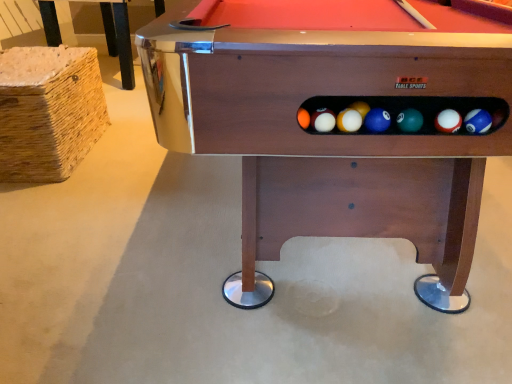
From the picture: What is the approximate width of wooden billiard table at center?

wooden billiard table at center is 3.46 feet wide.

Describe the element at coordinates (339, 132) in the screenshot. I see `wooden billiard table at center` at that location.

Identify the location of wooden billiard table at center. (339, 132).

You are a GUI agent. You are given a task and a screenshot of the screen. Output one action in this format:
    pyautogui.click(x=<x>, y=<y>)
    Task: Click on the shiny metallic pool table at upper left
    This screenshot has height=384, width=512.
    Given the screenshot: What is the action you would take?
    pyautogui.click(x=119, y=38)

The image size is (512, 384). What do you see at coordinates (119, 38) in the screenshot?
I see `shiny metallic pool table at upper left` at bounding box center [119, 38].

Identify the location of wooden billiard table at center. The image size is (512, 384). (339, 132).

Would you say wooden billiard table at center is to the left or to the right of shiny metallic pool table at upper left in the picture?

Based on their positions, wooden billiard table at center is located to the right of shiny metallic pool table at upper left.

Is the depth of wooden billiard table at center less than that of shiny metallic pool table at upper left?

Yes, wooden billiard table at center is closer to the viewer.

Which point is more distant from viewer, (505, 155) or (127, 19)?

The point (127, 19) is behind.

From the image's perspective, which one is positioned lower, wooden billiard table at center or shiny metallic pool table at upper left?

wooden billiard table at center, from the image's perspective.

From a real-world perspective, is wooden billiard table at center on top of shiny metallic pool table at upper left?

Yes, from a real-world perspective, wooden billiard table at center is on top of shiny metallic pool table at upper left.

Considering the sizes of objects wooden billiard table at center and shiny metallic pool table at upper left in the image provided, who is thinner, wooden billiard table at center or shiny metallic pool table at upper left?

wooden billiard table at center is thinner.

Considering the relative sizes of wooden billiard table at center and shiny metallic pool table at upper left in the image provided, is wooden billiard table at center taller than shiny metallic pool table at upper left?

Indeed, wooden billiard table at center has a greater height compared to shiny metallic pool table at upper left.

Which of these two, wooden billiard table at center or shiny metallic pool table at upper left, is smaller?

Smaller between the two is shiny metallic pool table at upper left.

Choose the correct answer: Is wooden billiard table at center inside shiny metallic pool table at upper left or outside it?

wooden billiard table at center lies outside shiny metallic pool table at upper left.

Is wooden billiard table at center not near shiny metallic pool table at upper left?

Indeed, wooden billiard table at center is not near shiny metallic pool table at upper left.

Could you tell me if wooden billiard table at center is facing shiny metallic pool table at upper left?

No, wooden billiard table at center is not turned towards shiny metallic pool table at upper left.

How different are the orientations of wooden billiard table at center and shiny metallic pool table at upper left in degrees?

2.32 degrees separate the facing orientations of wooden billiard table at center and shiny metallic pool table at upper left.

At what (x,y) coordinates should I click in order to perform the action: click on billiard table that appears below the shiny metallic pool table at upper left (from the image's perspective). Please return your answer as a coordinate pair (x, y). The image size is (512, 384). Looking at the image, I should click on (339, 132).

Between shiny metallic pool table at upper left and wooden billiard table at center, which one appears on the left side from the viewer's perspective?

From the viewer's perspective, shiny metallic pool table at upper left appears more on the left side.

Is shiny metallic pool table at upper left behind wooden billiard table at center?

That is True.

Which is farther from the camera, (49, 27) or (465, 38)?

Positioned behind is point (49, 27).

From the image's perspective, which is below, shiny metallic pool table at upper left or wooden billiard table at center?

wooden billiard table at center, from the image's perspective.

From a real-world perspective, is shiny metallic pool table at upper left located beneath wooden billiard table at center?

Correct, in the physical world, shiny metallic pool table at upper left is lower than wooden billiard table at center.

Is shiny metallic pool table at upper left thinner than wooden billiard table at center?

No, shiny metallic pool table at upper left is not thinner than wooden billiard table at center.

From their relative heights in the image, would you say shiny metallic pool table at upper left is taller or shorter than wooden billiard table at center?

Considering their sizes, shiny metallic pool table at upper left has less height than wooden billiard table at center.

Considering the sizes of objects shiny metallic pool table at upper left and wooden billiard table at center in the image provided, who is bigger, shiny metallic pool table at upper left or wooden billiard table at center?

wooden billiard table at center is bigger.

Is shiny metallic pool table at upper left outside of wooden billiard table at center?

Indeed, shiny metallic pool table at upper left is completely outside wooden billiard table at center.

Are shiny metallic pool table at upper left and wooden billiard table at center making contact?

No, shiny metallic pool table at upper left is not making contact with wooden billiard table at center.

Is shiny metallic pool table at upper left oriented away from wooden billiard table at center?

No, shiny metallic pool table at upper left's orientation is not away from wooden billiard table at center.

How many degrees apart are the facing directions of shiny metallic pool table at upper left and wooden billiard table at center?

The facing directions of shiny metallic pool table at upper left and wooden billiard table at center are 2.32 degrees apart.

I want to click on table located above the wooden billiard table at center (from the image's perspective), so click(x=119, y=38).

Locate an element on the screen. The image size is (512, 384). billiard table above the shiny metallic pool table at upper left (from a real-world perspective) is located at coordinates (339, 132).

You are a GUI agent. You are given a task and a screenshot of the screen. Output one action in this format:
    pyautogui.click(x=<x>, y=<y>)
    Task: Click on the table behind the wooden billiard table at center
    The height and width of the screenshot is (384, 512).
    Given the screenshot: What is the action you would take?
    pyautogui.click(x=119, y=38)